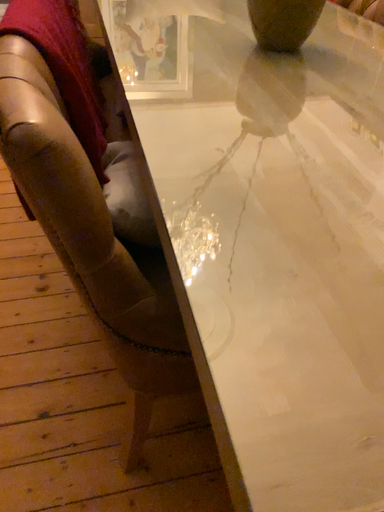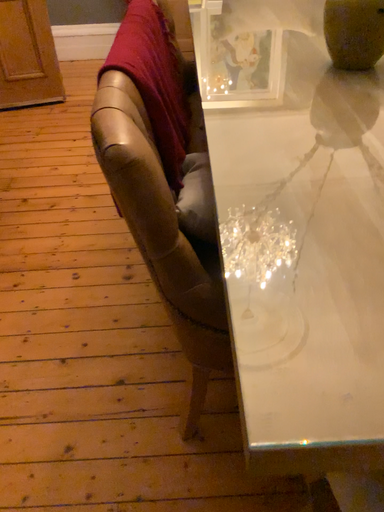
Question: How did the camera likely rotate when shooting the video?

Choices:
 (A) rotated right
 (B) rotated left

Answer: (B)